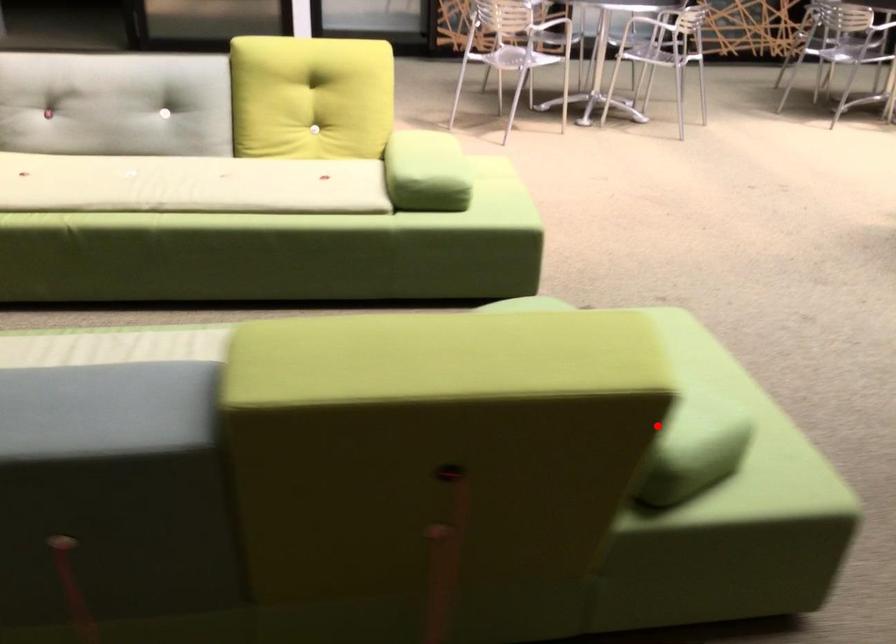
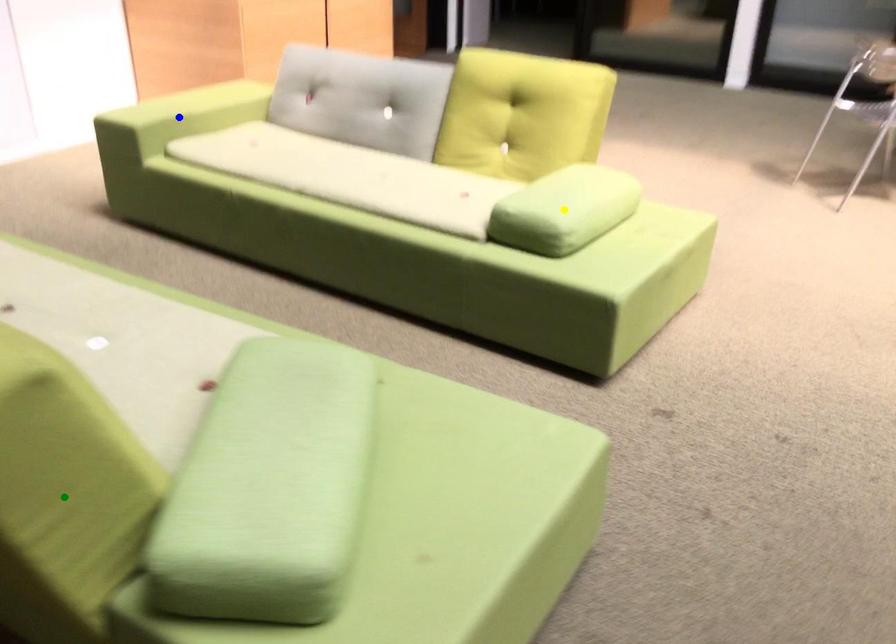
Question: I am providing you with two images of the same scene from different viewpoints. A red point is marked on the first image. You are given multiple points on the second image. In image 2, which mark is for the same physical point as the one in image 1?

Choices:
 (A) blue point
 (B) yellow point
 (C) green point

Answer: (C)